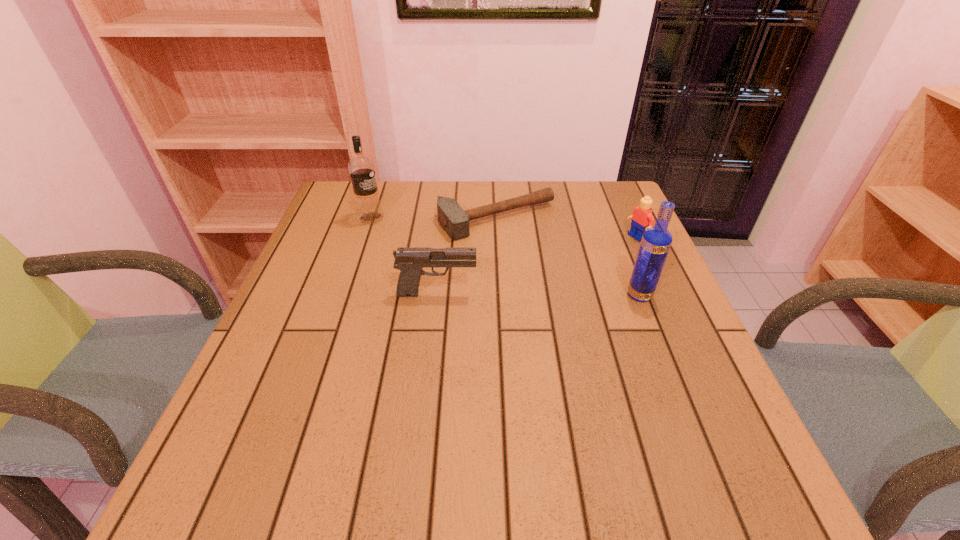
Where is `pistol`? The image size is (960, 540). pistol is located at coordinates (410, 261).

Find the location of `the nearer vodka`. the nearer vodka is located at coordinates (656, 241).

Locate an element on the screen. the farther vodka is located at coordinates (361, 168).

Locate an element on the screen. the leftmost object is located at coordinates [x=361, y=168].

The width and height of the screenshot is (960, 540). In order to click on the shortest object in this screenshot , I will do `click(455, 221)`.

Find the location of a particular element. Lego is located at coordinates (642, 217).

You are a GUI agent. You are given a task and a screenshot of the screen. Output one action in this format:
    pyautogui.click(x=<x>, y=<y>)
    Task: Click on the vacant space located 0.090m aim along the barrel of the pistol
    
    Given the screenshot: What is the action you would take?
    pyautogui.click(x=516, y=293)

This screenshot has width=960, height=540. Identify the location of free spot located 0.270m on the left of the right vodka. (509, 295).

Where is `free space located on the label of the farther vodka`? The width and height of the screenshot is (960, 540). free space located on the label of the farther vodka is located at coordinates (441, 251).

The width and height of the screenshot is (960, 540). What are the coordinates of `free space located 0.110m on the label of the farther vodka` in the screenshot? It's located at (409, 237).